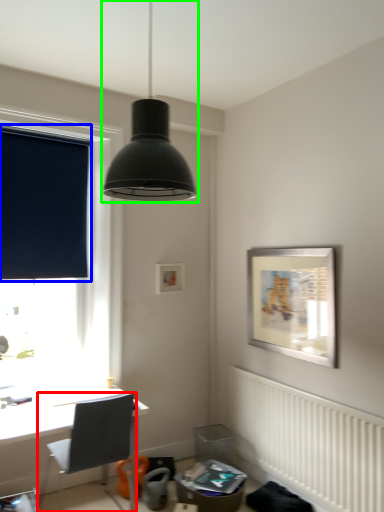
Question: Estimate the real-world distances between objects in this image. Which object is closer to chair (highlighted by a red box), window screen (highlighted by a blue box) or lamp (highlighted by a green box)?

Choices:
 (A) window screen
 (B) lamp

Answer: (A)